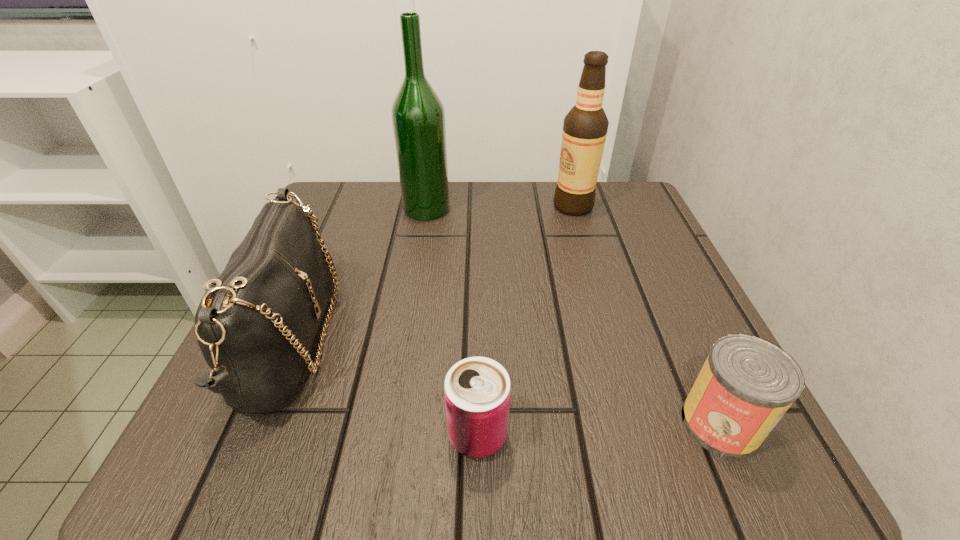
Locate which object ranks fourth in proximity to the right can. Please provide its 2D coordinates. Your answer should be formatted as a tuple, i.e. [(x, y)], where the tuple contains the x and y coordinates of a point satisfying the conditions above.

[(418, 117)]

In order to click on free space that satisfies the following two spatial constraints: 1. at the front of the third shortest object with chain and zipper; 2. on the right side of the third object from left to right in this screenshot , I will do `click(248, 435)`.

Identify the location of vacant point that satisfies the following two spatial constraints: 1. on the label of the fourth shortest object; 2. on the right side of the right can. The image size is (960, 540). coord(637,423).

Identify the location of vacant space that satisfies the following two spatial constraints: 1. on the back side of the third object from left to right; 2. at the front of the leftmost object with chain and zipper. (478, 341).

Find the location of `free space that satisfies the following two spatial constraints: 1. at the front of the handbag with chain and zipper; 2. on the back side of the right can`. free space that satisfies the following two spatial constraints: 1. at the front of the handbag with chain and zipper; 2. on the back side of the right can is located at coordinates tap(252, 423).

Locate an element on the screen. free spot that satisfies the following two spatial constraints: 1. at the front of the third object from left to right with chain and zipper; 2. on the left side of the third tallest object is located at coordinates (248, 435).

Locate an element on the screen. The image size is (960, 540). free region that satisfies the following two spatial constraints: 1. on the front side of the left can; 2. on the left side of the tallest object is located at coordinates (389, 435).

You are a GUI agent. You are given a task and a screenshot of the screen. Output one action in this format:
    pyautogui.click(x=<x>, y=<y>)
    Task: Click on the vacant space that satisfies the following two spatial constraints: 1. on the label of the second tallest object; 2. on the right side of the rightmost object
    This screenshot has height=540, width=960.
    Given the screenshot: What is the action you would take?
    (x=637, y=423)